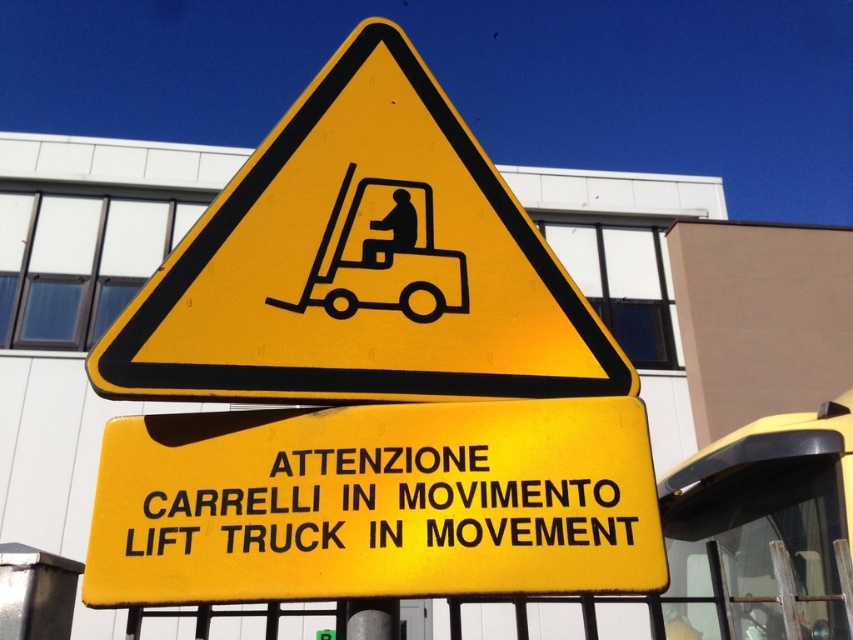
You are a pedestrian walking near the sign and need to locate the yellow matte triangle at upper center and the black matte forklift at center. Which object is located to the left of the other?

The yellow matte triangle at upper center is positioned on the left side of black matte forklift at center.

You are a pedestrian walking near the yellow matte sign at center and the black matte forklift at center. Which object is located higher up in the image?

The black matte forklift at center is located higher up in the image than the yellow matte sign at center.

You are a pedestrian walking towards the yellow matte sign at center and the black matte forklift at center. Which object will you encounter first?

The yellow matte sign at center is closer to the viewer than the black matte forklift at center, so you will encounter the yellow matte sign at center first.